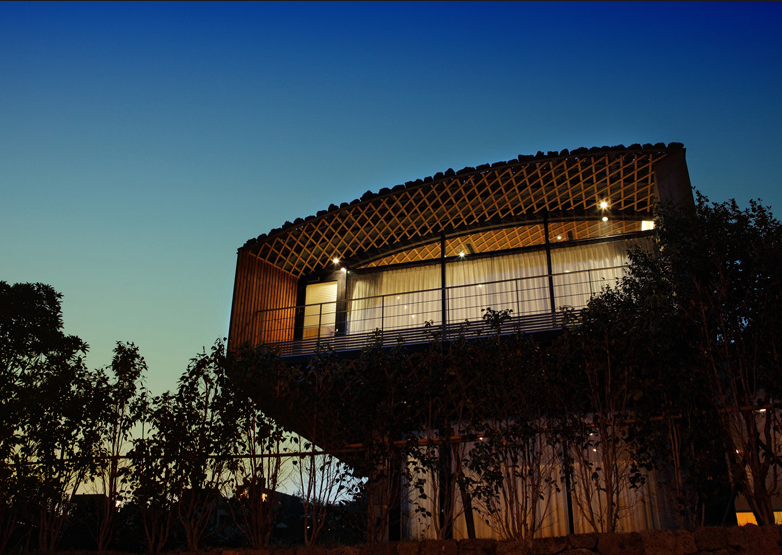
In order to click on door in this screenshot , I will do `click(325, 284)`.